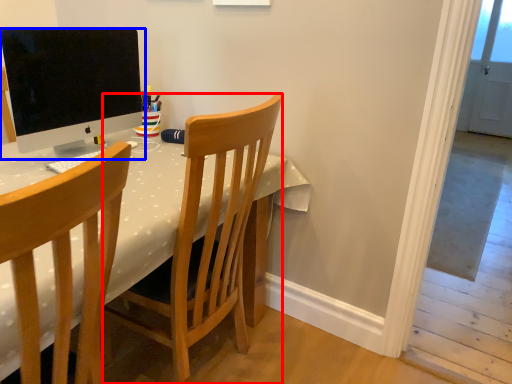
Question: Which point is closer to the camera, chair (highlighted by a red box) or computer monitor (highlighted by a blue box)?

Choices:
 (A) chair
 (B) computer monitor

Answer: (A)